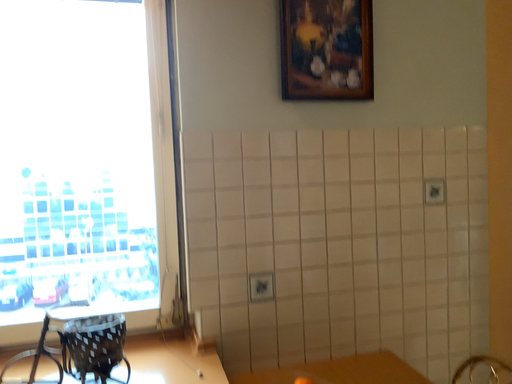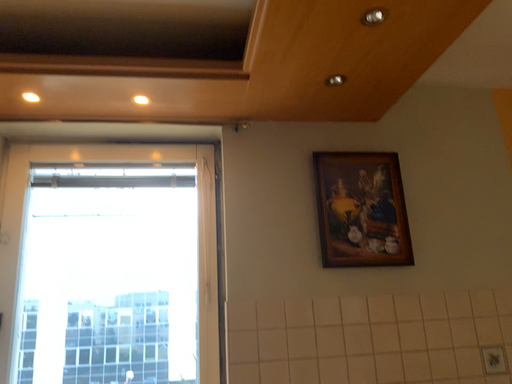
Question: Which way did the camera rotate in the video?

Choices:
 (A) rotated upward
 (B) rotated downward

Answer: (A)